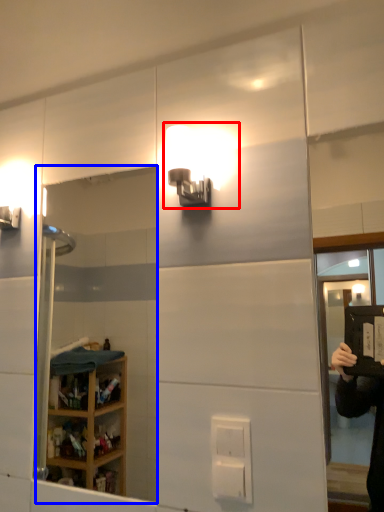
Question: Which object appears farthest to the camera in this image, light fixture (highlighted by a red box) or mirror (highlighted by a blue box)?

Choices:
 (A) light fixture
 (B) mirror

Answer: (B)